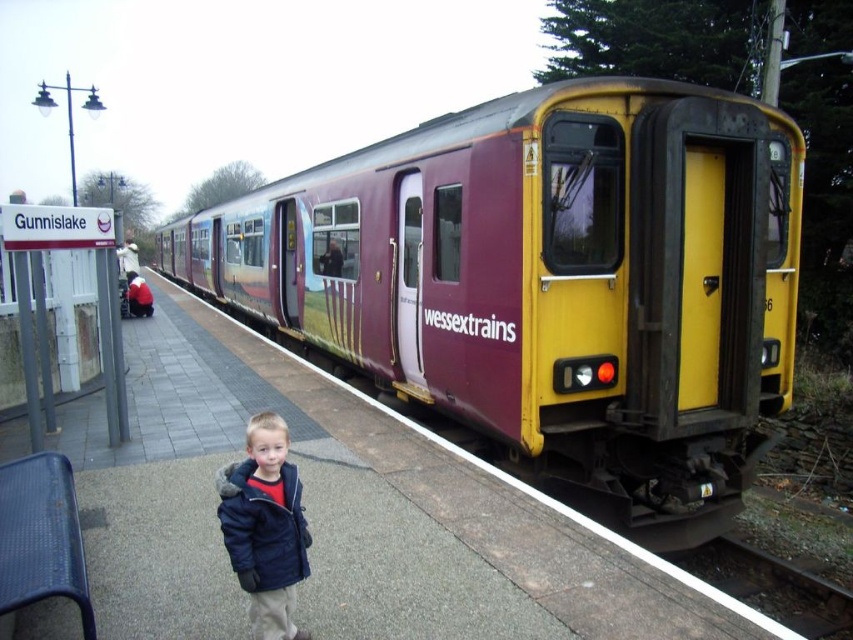
Which is more to the left, maroon/yellow metal train at center or dark blue fleece jacket at center?

Positioned to the left is maroon/yellow metal train at center.

Does maroon/yellow metal train at center lie behind dark blue fleece jacket at center?

Yes, it is.

Between point (315, 177) and point (287, 525), which one is positioned in front?

Point (287, 525) is in front.

Identify the location of maroon/yellow metal train at center. This screenshot has height=640, width=853. (548, 282).

Does point (352, 221) lie behind point (831, 600)?

Yes, it is.

Does maroon/yellow metal train at center have a greater height compared to metal/smooth train track at lower right?

Yes, maroon/yellow metal train at center is taller than metal/smooth train track at lower right.

Which is in front, point (721, 243) or point (773, 598)?

Point (773, 598) is more forward.

You are a GUI agent. You are given a task and a screenshot of the screen. Output one action in this format:
    pyautogui.click(x=<x>, y=<y>)
    Task: Click on the maroon/yellow metal train at center
    This screenshot has height=640, width=853.
    Given the screenshot: What is the action you would take?
    pyautogui.click(x=548, y=282)

Consider the image. Measure the distance between point (254, 486) and camera.

The distance of point (254, 486) from camera is 3.01 meters.

Is point (300, 630) positioned before point (747, 563)?

That is True.

Find the location of a particular element. The height and width of the screenshot is (640, 853). dark blue fleece jacket at center is located at coordinates [265, 525].